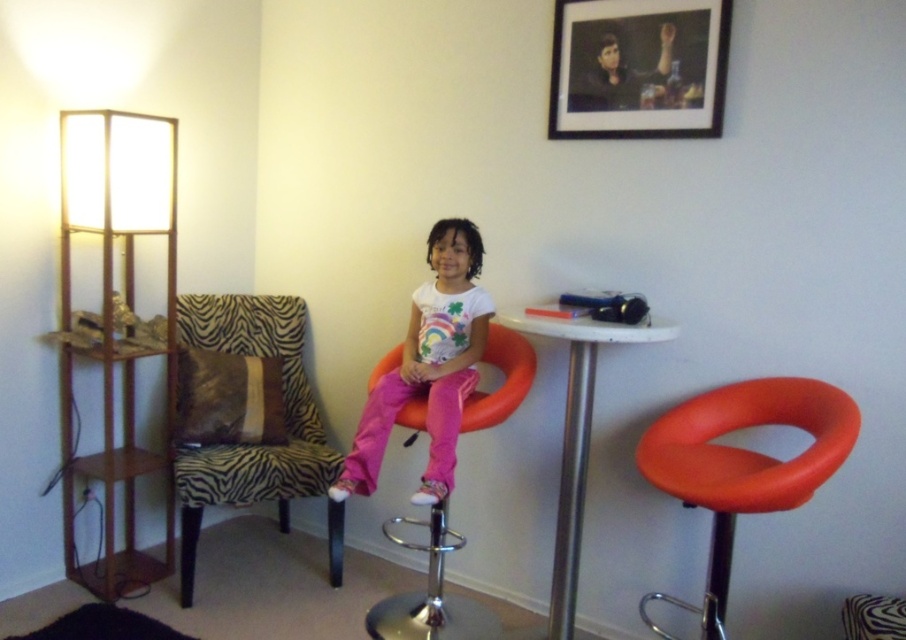
Is black matte picture frame at upper center wider than pink fabric pants at center?

In fact, black matte picture frame at upper center might be narrower than pink fabric pants at center.

Based on the photo, between black matte picture frame at upper center and pink fabric pants at center, which one appears on the right side from the viewer's perspective?

Positioned to the right is black matte picture frame at upper center.

Is point (707, 29) farther from viewer compared to point (437, 396)?

No.

This screenshot has height=640, width=906. I want to click on black matte picture frame at upper center, so click(x=638, y=67).

Can you confirm if zebra-patterned fabric chair at left is thinner than orange matte stool at center?

No, zebra-patterned fabric chair at left is not thinner than orange matte stool at center.

Which of these two, zebra-patterned fabric chair at left or orange matte stool at center, stands taller?

zebra-patterned fabric chair at left

Between point (235, 477) and point (454, 436), which one is positioned in front?

Point (454, 436)

Identify the location of zebra-patterned fabric chair at left. The width and height of the screenshot is (906, 640). (249, 444).

Can you confirm if orange matte bar stool at center is positioned below white glossy table at center?

→ No, orange matte bar stool at center is not below white glossy table at center.

Is point (637, 608) positioned after point (561, 472)?

Yes, it is.

I want to click on orange matte bar stool at center, so click(741, 467).

I want to click on orange matte bar stool at center, so click(741, 467).